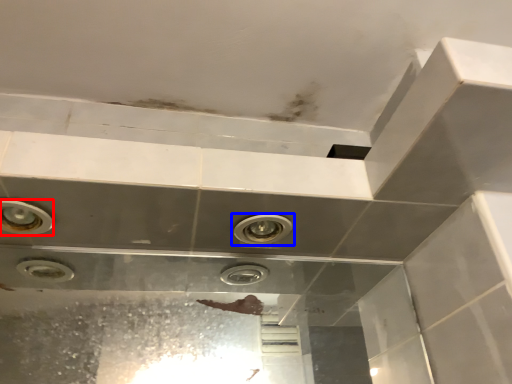
Question: Among these objects, which one is nearest to the camera, bubble (highlighted by a red box) or plumbing fixture (highlighted by a blue box)?

Choices:
 (A) bubble
 (B) plumbing fixture

Answer: (A)